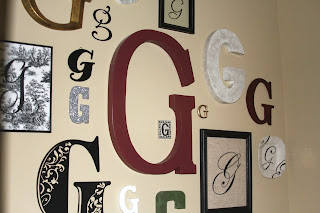
Locate an element on the screen. Image resolution: width=320 pixels, height=213 pixels. plate with a g is located at coordinates (272, 159).